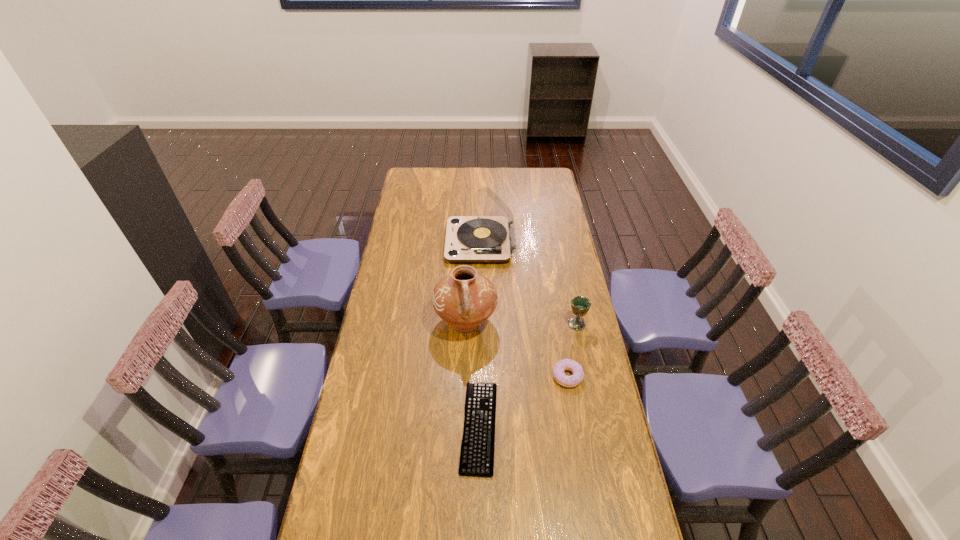
I want to click on free space located on the front of the second shortest object, so click(575, 421).

Identify the location of vacant space positioned 0.330m on the back of the shortest object. The image size is (960, 540). (x=479, y=315).

Identify the location of chalice at the right edge. The image size is (960, 540). (580, 305).

This screenshot has width=960, height=540. I want to click on doughnut present at the right edge, so click(x=566, y=364).

The width and height of the screenshot is (960, 540). In order to click on blank space at the far edge of the desktop in this screenshot , I will do `click(510, 180)`.

The width and height of the screenshot is (960, 540). In order to click on free space at the left edge of the desktop in this screenshot , I will do `click(365, 376)`.

This screenshot has height=540, width=960. In the image, there is a desktop. In order to click on free space at the right edge in this screenshot , I will do `click(553, 296)`.

Locate an element on the screen. Image resolution: width=960 pixels, height=540 pixels. vacant space at the far left corner is located at coordinates (420, 172).

Where is `free region at the far right corner of the desktop`? free region at the far right corner of the desktop is located at coordinates (550, 169).

At what (x,y) coordinates should I click in order to perform the action: click on vacant space that is in between the pottery and the fourth tallest object. Please return your answer as a coordinate pair (x, y). Looking at the image, I should click on (516, 349).